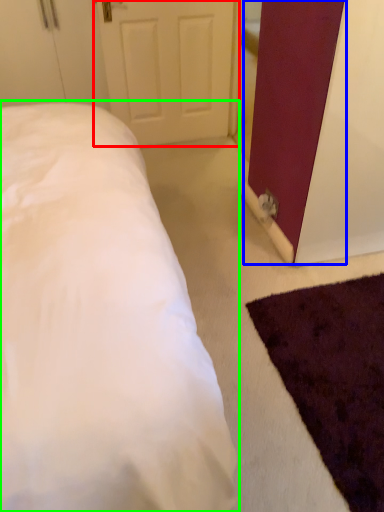
Question: Which object is positioned closest to door (highlighted by a red box)? Select from barn door (highlighted by a blue box) and bed (highlighted by a green box).

Choices:
 (A) barn door
 (B) bed

Answer: (A)